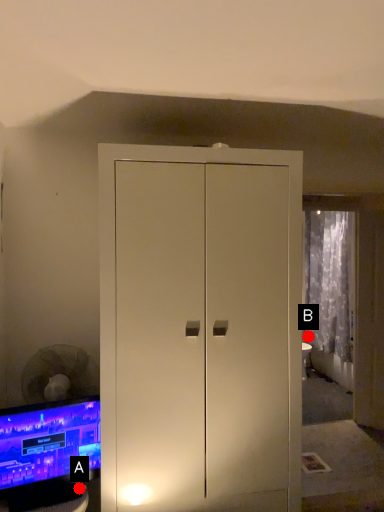
Question: Two points are circled on the image, labeled by A and B beside each circle. Which point appears farthest from the camera in this image?

Choices:
 (A) A is further
 (B) B is further

Answer: (B)